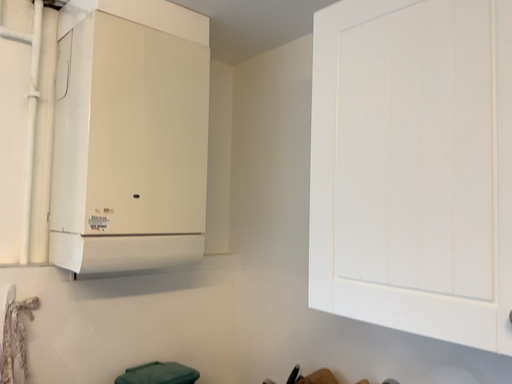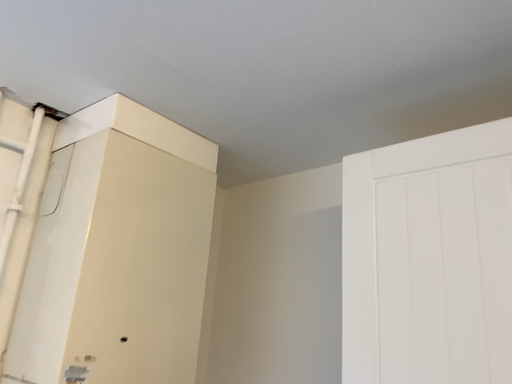
Question: Which way did the camera rotate in the video?

Choices:
 (A) rotated right
 (B) rotated left

Answer: (A)